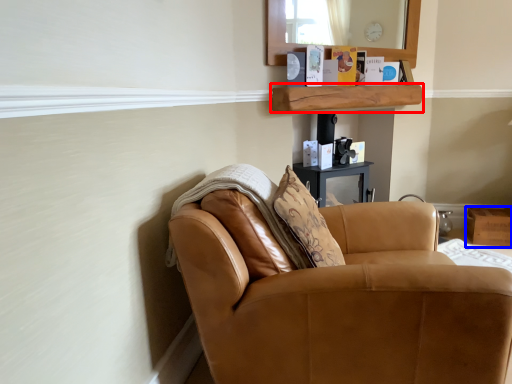
Question: Which point is closer to the camera, shelf (highlighted by a red box) or box (highlighted by a blue box)?

Choices:
 (A) shelf
 (B) box

Answer: (A)